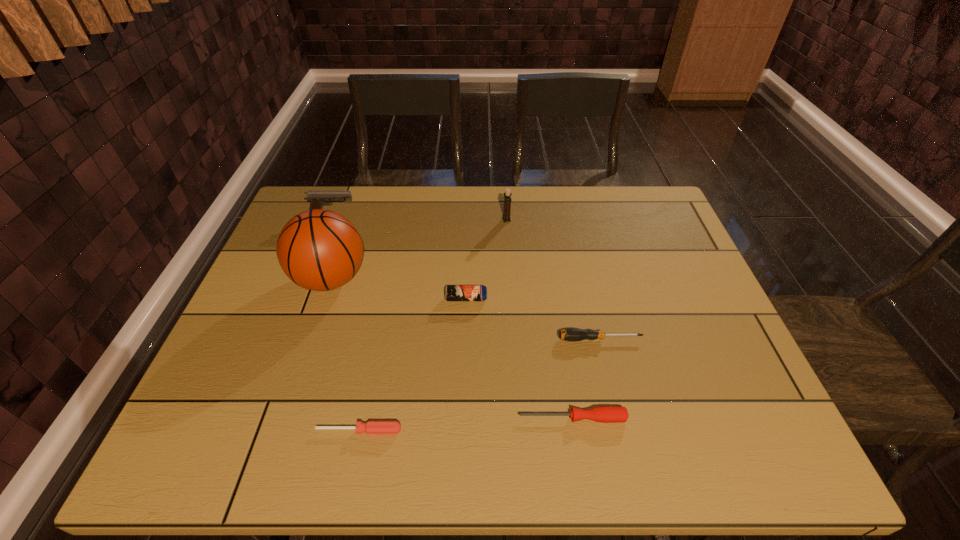
Locate an element on the screen. This screenshot has width=960, height=540. pistol that is at the far edge is located at coordinates (316, 198).

Find the location of `basketball that is positioned at the left edge`. basketball that is positioned at the left edge is located at coordinates (320, 250).

What are the coordinates of `pistol at the left edge` in the screenshot? It's located at (316, 198).

Image resolution: width=960 pixels, height=540 pixels. I want to click on object that is at the far left corner, so click(x=316, y=198).

In the image, there is a desktop. Where is `vacant space at the far edge`? The height and width of the screenshot is (540, 960). vacant space at the far edge is located at coordinates (513, 197).

The height and width of the screenshot is (540, 960). I want to click on free space at the near edge of the desktop, so click(x=684, y=430).

Find the location of a particular element. The height and width of the screenshot is (540, 960). vacant area at the left edge is located at coordinates (258, 401).

At what (x,y) coordinates should I click in order to perform the action: click on vacant space at the right edge. Please return your answer as a coordinate pair (x, y). Looking at the image, I should click on (712, 348).

Locate an element on the screen. vacant region at the far right corner is located at coordinates (626, 200).

You are a GUI agent. You are given a task and a screenshot of the screen. Output one action in this format:
    pyautogui.click(x=<x>, y=<y>)
    Task: Click on the vacant area at the near right corner
    This screenshot has width=960, height=540.
    Given the screenshot: What is the action you would take?
    pyautogui.click(x=708, y=442)